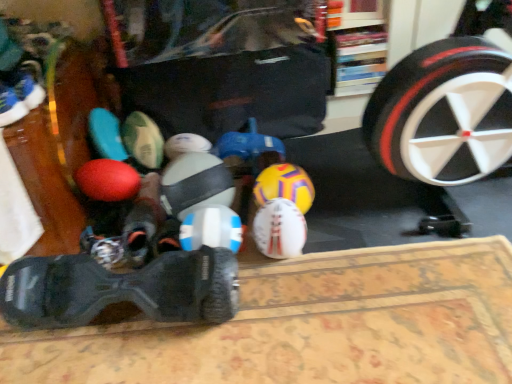
Question: Can you confirm if white matte soccer ball at center, marked as the 3th toy in a left-to-right arrangement, is smaller than white matte soccer ball at center, the fourth toy from the right?

Choices:
 (A) no
 (B) yes

Answer: (B)

Question: From the image's perspective, would you say white matte soccer ball at center, marked as the 3th toy in a left-to-right arrangement, is positioned over white matte soccer ball at center, the 1th toy in the left-to-right sequence?

Choices:
 (A) yes
 (B) no

Answer: (B)

Question: Could you tell me if white matte soccer ball at center, arranged as the 2th toy when viewed from the right, is turned towards white matte soccer ball at center, the 1th toy in the left-to-right sequence?

Choices:
 (A) no
 (B) yes

Answer: (A)

Question: Is white matte soccer ball at center, marked as the 3th toy in a left-to-right arrangement, oriented away from white matte soccer ball at center, the fourth toy from the right?

Choices:
 (A) no
 (B) yes

Answer: (A)

Question: Considering the relative sizes of white matte soccer ball at center, arranged as the 2th toy when viewed from the right, and white matte soccer ball at center, the fourth toy from the right, in the image provided, is white matte soccer ball at center, arranged as the 2th toy when viewed from the right, bigger than white matte soccer ball at center, the fourth toy from the right,?

Choices:
 (A) yes
 (B) no

Answer: (B)

Question: Can you confirm if white matte soccer ball at center, arranged as the 2th toy when viewed from the right, is shorter than white matte soccer ball at center, the 1th toy in the left-to-right sequence?

Choices:
 (A) no
 (B) yes

Answer: (B)

Question: Is black rubber remote control at lower left, marked as the first footwear in a bottom-to-top arrangement, looking in the opposite direction of white matte soccer ball at center, the 1th toy in the left-to-right sequence?

Choices:
 (A) yes
 (B) no

Answer: (A)

Question: Does black rubber remote control at lower left, marked as the first footwear in a bottom-to-top arrangement, have a smaller size compared to white matte soccer ball at center, the 1th toy in the left-to-right sequence?

Choices:
 (A) yes
 (B) no

Answer: (B)

Question: Does black rubber remote control at lower left, marked as the first footwear in a bottom-to-top arrangement, have a larger size compared to white matte soccer ball at center, the 1th toy in the left-to-right sequence?

Choices:
 (A) yes
 (B) no

Answer: (A)

Question: Considering the relative sizes of black rubber remote control at lower left, which ranks as the 2th footwear in left-to-right order, and white matte soccer ball at center, the fourth toy from the right, in the image provided, is black rubber remote control at lower left, which ranks as the 2th footwear in left-to-right order, shorter than white matte soccer ball at center, the fourth toy from the right,?

Choices:
 (A) no
 (B) yes

Answer: (A)

Question: From a real-world perspective, is black rubber remote control at lower left, which ranks as the 2th footwear in left-to-right order, on top of white matte soccer ball at center, the 1th toy in the left-to-right sequence?

Choices:
 (A) yes
 (B) no

Answer: (B)

Question: Considering the relative positions of black rubber remote control at lower left, marked as the first footwear in a bottom-to-top arrangement, and white matte soccer ball at center, the fourth toy from the right, in the image provided, is black rubber remote control at lower left, marked as the first footwear in a bottom-to-top arrangement, behind white matte soccer ball at center, the fourth toy from the right,?

Choices:
 (A) no
 (B) yes

Answer: (A)

Question: Is white matte soccer ball at center, the 1th toy in the left-to-right sequence, bigger than black rubber remote control at lower left, marked as the first footwear in a bottom-to-top arrangement?

Choices:
 (A) no
 (B) yes

Answer: (A)